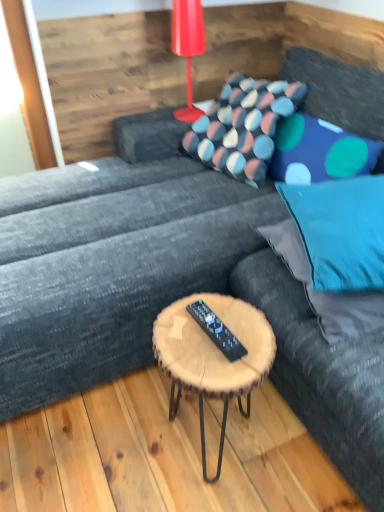
Question: Is blue fabric pillow at upper right, acting as the 2th pillow starting from the back, facing away from black plastic remote at center?

Choices:
 (A) yes
 (B) no

Answer: (B)

Question: From a real-world perspective, is blue fabric pillow at upper right, the 3th pillow viewed from the front, over black plastic remote at center?

Choices:
 (A) no
 (B) yes

Answer: (B)

Question: Is blue fabric pillow at upper right, acting as the 2th pillow starting from the back, behind black plastic remote at center?

Choices:
 (A) no
 (B) yes

Answer: (B)

Question: Can you confirm if blue fabric pillow at upper right, the 3th pillow viewed from the front, is shorter than black plastic remote at center?

Choices:
 (A) yes
 (B) no

Answer: (B)

Question: Considering the relative sizes of blue fabric pillow at upper right, the 3th pillow viewed from the front, and black plastic remote at center in the image provided, is blue fabric pillow at upper right, the 3th pillow viewed from the front, wider than black plastic remote at center?

Choices:
 (A) yes
 (B) no

Answer: (A)

Question: Considering the relative sizes of blue fabric pillow at upper right, acting as the 2th pillow starting from the back, and black plastic remote at center in the image provided, is blue fabric pillow at upper right, acting as the 2th pillow starting from the back, smaller than black plastic remote at center?

Choices:
 (A) yes
 (B) no

Answer: (B)

Question: From a real-world perspective, is black plastic remote at center on top of blue fabric pillow at upper right, the 3th pillow viewed from the front?

Choices:
 (A) yes
 (B) no

Answer: (B)

Question: Does black plastic remote at center have a smaller size compared to blue fabric pillow at upper right, the 3th pillow viewed from the front?

Choices:
 (A) yes
 (B) no

Answer: (A)

Question: From the image's perspective, is black plastic remote at center on blue fabric pillow at upper right, acting as the 2th pillow starting from the back?

Choices:
 (A) no
 (B) yes

Answer: (A)

Question: From the image's perspective, would you say black plastic remote at center is shown under blue fabric pillow at upper right, the 3th pillow viewed from the front?

Choices:
 (A) no
 (B) yes

Answer: (B)

Question: Does black plastic remote at center have a larger size compared to blue fabric pillow at upper right, acting as the 2th pillow starting from the back?

Choices:
 (A) no
 (B) yes

Answer: (A)

Question: Does black plastic remote at center have a lesser width compared to blue fabric pillow at upper right, acting as the 2th pillow starting from the back?

Choices:
 (A) no
 (B) yes

Answer: (B)

Question: From the image's perspective, is blue fabric pillow at right, the 4th pillow in the back-to-front sequence, on woodenmaterial/texturecoffee table at center?

Choices:
 (A) yes
 (B) no

Answer: (A)